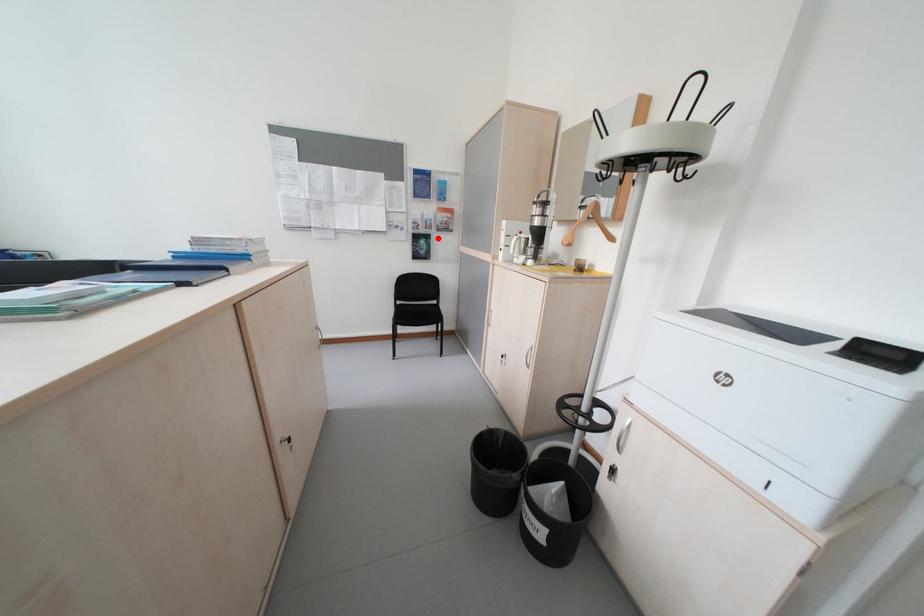
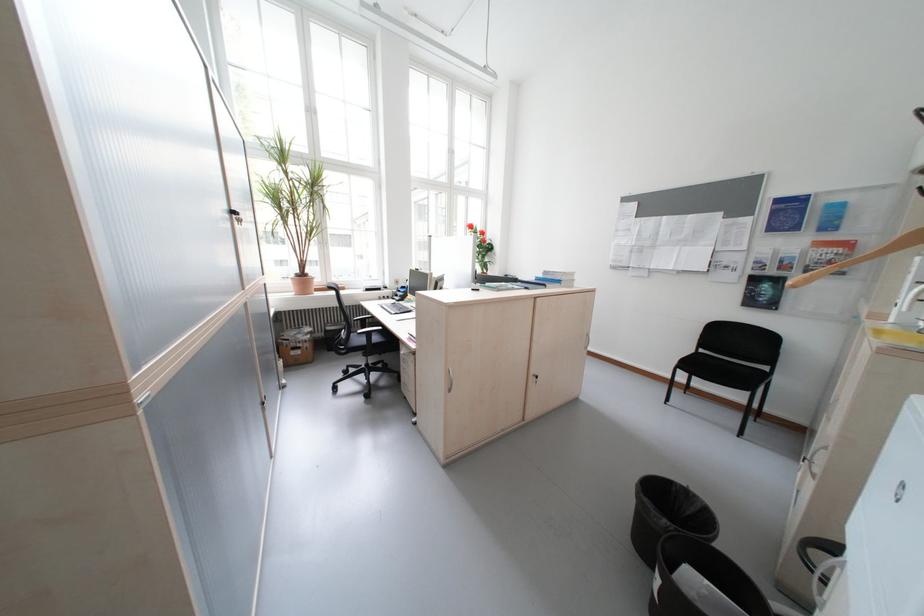
Locate, in the second image, the point that corresponds to the highlighted location in the first image.

(788, 282)